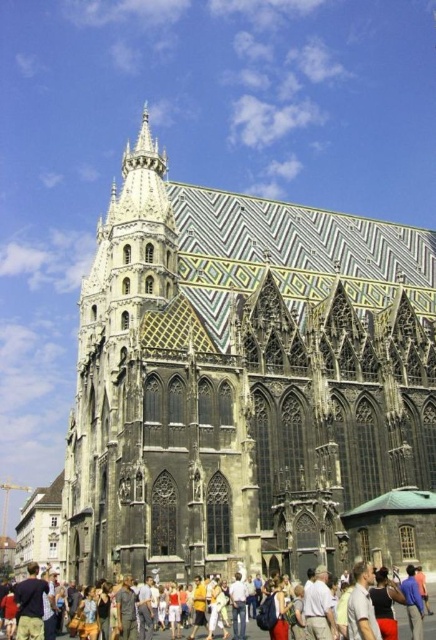
You are a photographer planning to take a wide shot of the multicolored mosaic tile church at center and the multicolored fabric crowd at lower center. Based on their sizes, which one should you focus on to ensure it fills the frame appropriately?

The multicolored mosaic tile church at center might be wider than multicolored fabric crowd at lower center, so focusing on the church would better fill the frame appropriately.

You are a tourist holding a 10 cm wide postcard of the multicolored mosaic tile church at center. You want to compare its size with the multicolored fabric crowd at lower center in the image. Which one appears bigger in the picture?

The multicolored mosaic tile church at center appears bigger in the picture as it has a larger size compared to the multicolored fabric crowd at lower center.

You are standing in front of St. Stephen Cathedral in Vienna. You see two points marked on the cathedral facade. The first point is at coordinate point (128, 380) and the second is at point (429, 596). Which point is closer to you?

Point (128, 380) is closer to you because it is further to the viewer than point (429, 596).